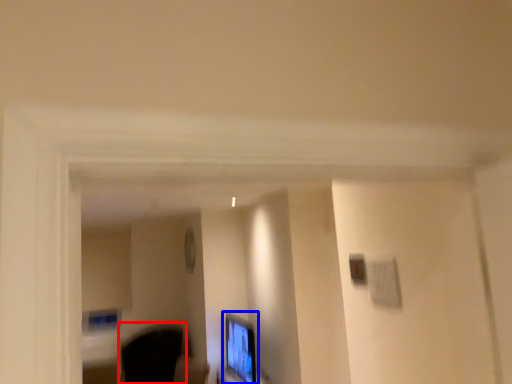
Question: Which point is closer to the camera, swivel chair (highlighted by a red box) or computer monitor (highlighted by a blue box)?

Choices:
 (A) swivel chair
 (B) computer monitor

Answer: (B)